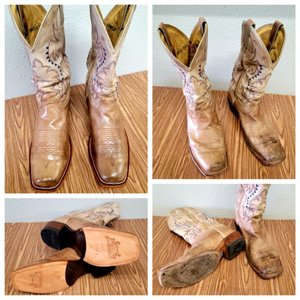
Locate an element on the screen. This screenshot has width=300, height=300. wall is located at coordinates click(45, 214).